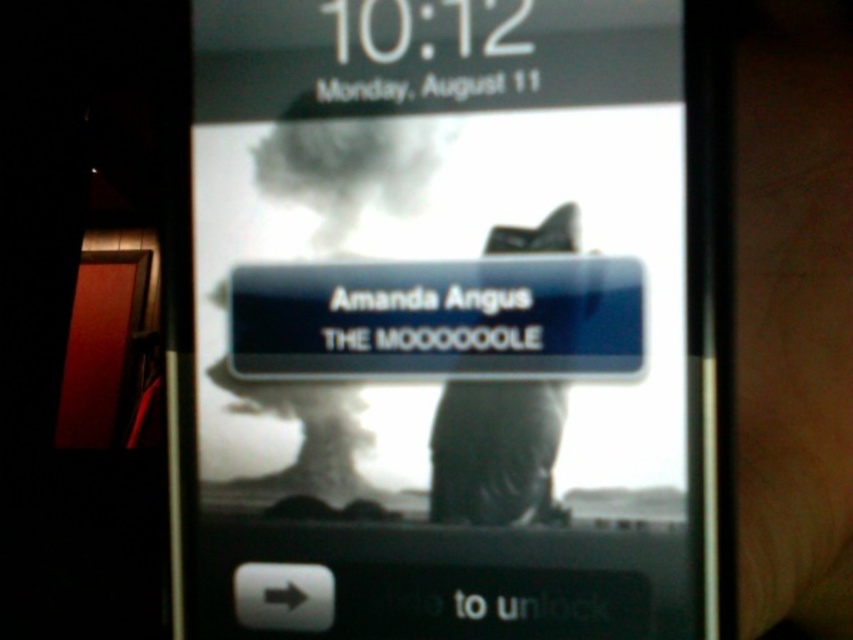
You are holding a phone and want to unlock it by swiping your finger from the matte black phone at center to the brown leather hand at right. Can you do this without moving your hand more than 6 inches?

The distance between the matte black phone at center and the brown leather hand at right is 5.91 inches, so yes, you can swipe your finger without moving more than 6 inches.

You are holding a smartphone with the lock screen shown. You want to unlock it by swiping from the point at coordinate point (737, 280) to the bottom edge of the screen. Given that the distance from your thumb to the point is 19.70 inches, can your thumb reach the point without moving your hand?

The distance between the point (737, 280) and the viewer is 19.70 inches. Since the thumb needs to reach this point, and assuming typical smartphone sizes, 19.70 inches is likely too far for a thumb to comfortably reach without moving the hand. Therefore, the thumb cannot reach the point without moving the hand.

You are holding a brown leather hand at right and want to place it on the matte black phone at center. Will the hand fit completely on the phone?

The matte black phone at center might be wider than brown leather hand at right, so there is a possibility that the hand can fit completely on the phone, but there is uncertainty due to the comparative size mentioned as a possibility.